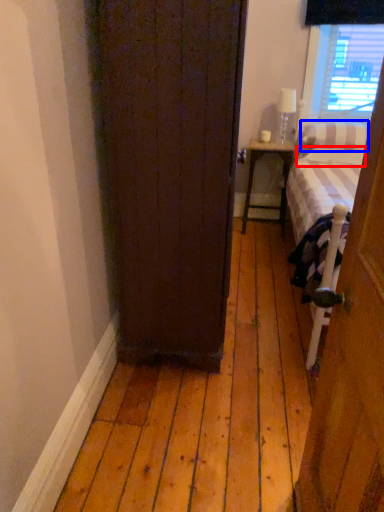
Question: Which point is closer to the camera, pillow (highlighted by a red box) or pillow (highlighted by a blue box)?

Choices:
 (A) pillow
 (B) pillow

Answer: (B)